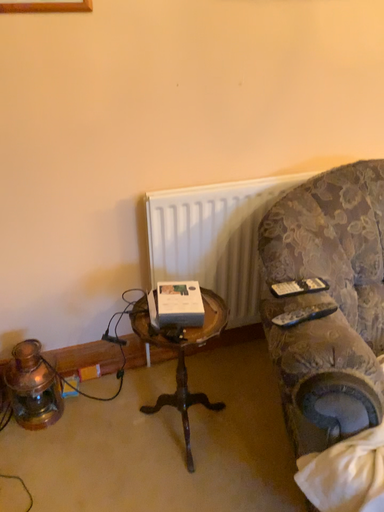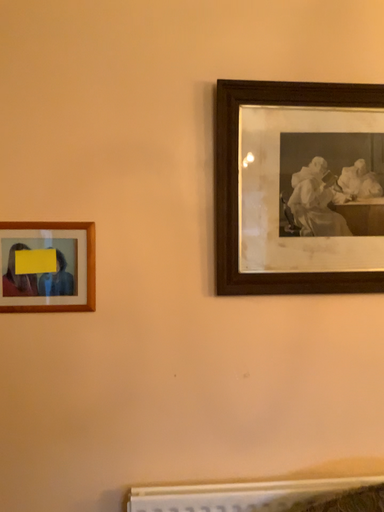
Question: Which way did the camera rotate in the video?

Choices:
 (A) rotated downward
 (B) rotated upward

Answer: (B)